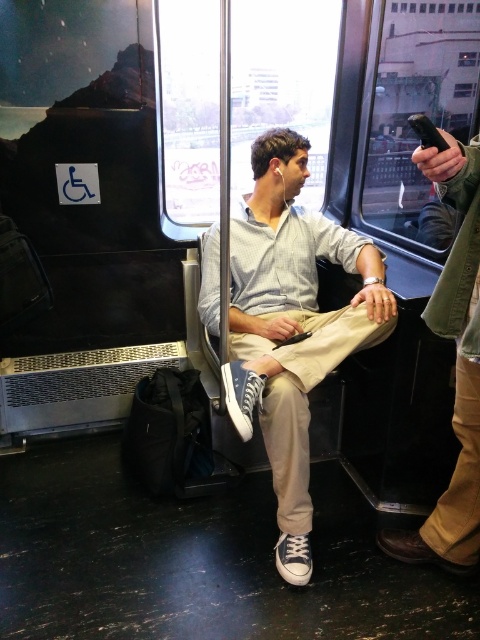
You are a passenger on a subway car and you see a light gray cotton shirt at center and a brown leather phone at right. Which object is bigger in size?

The light gray cotton shirt at center is larger in size compared to the brown leather phone at right.

You are standing in the subway car and want to find the light gray cotton shirt at center. Based on the coordinates provided in the Objects Description, can you determine its position relative to the center of the image?

The light gray cotton shirt at center is located at coordinates point (291, 324), which is slightly to the right and above the center of the image.